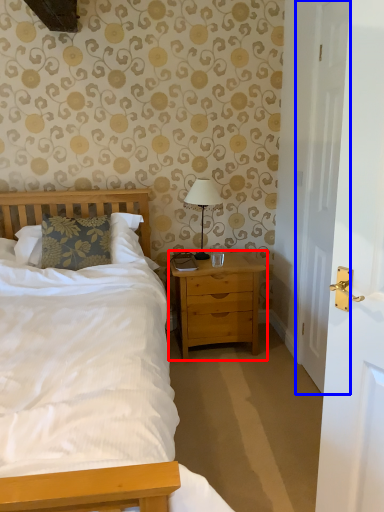
Question: Which object is further to the camera taking this photo, nightstand (highlighted by a red box) or door (highlighted by a blue box)?

Choices:
 (A) nightstand
 (B) door

Answer: (A)